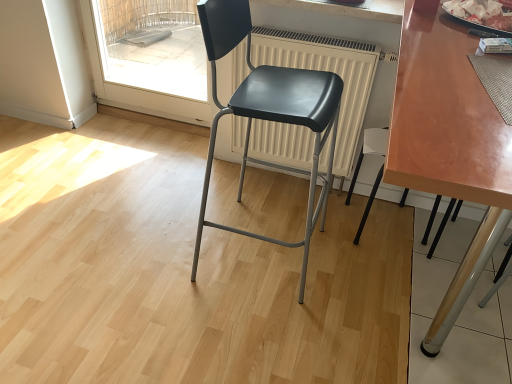
I want to click on free space to the left of matte black chair at center, which is the 1th chair in left-to-right order, so click(154, 245).